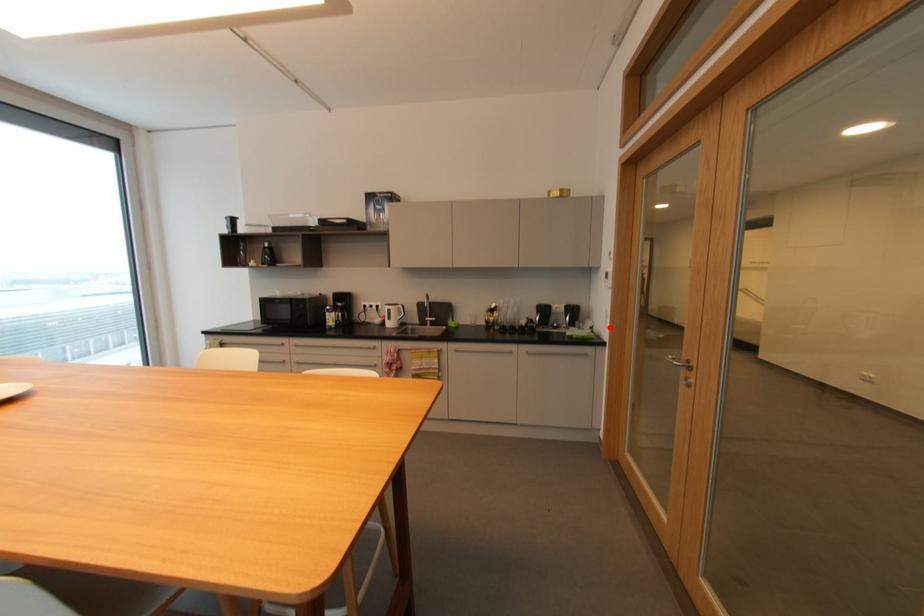
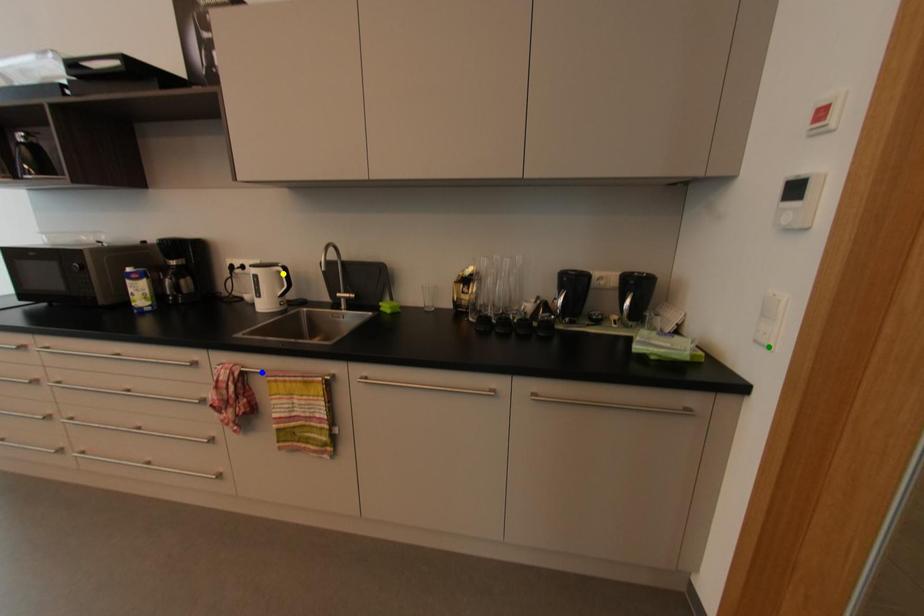
Question: I am providing you with two images of the same scene from different viewpoints. A red point is marked on the first image. You are given multiple points on the second image. Can you choose the point in image 2 that corresponds to the point in image 1?

Choices:
 (A) green point
 (B) blue point
 (C) yellow point

Answer: (A)